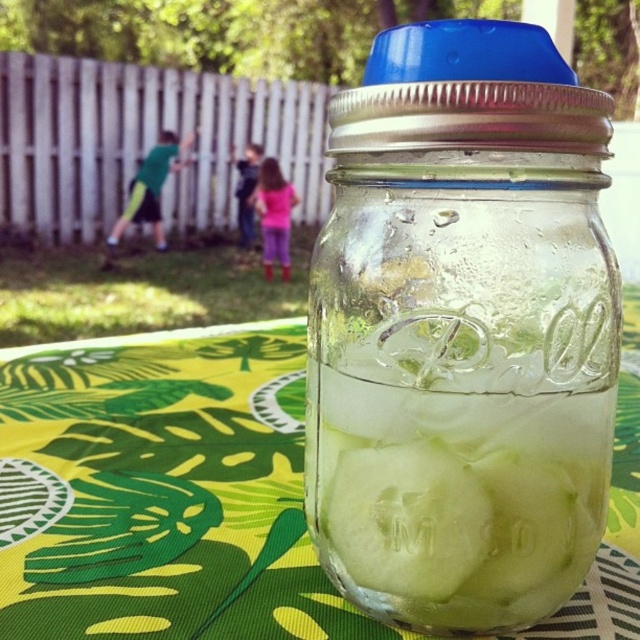
Question: Does clear glass jar at center have a greater width compared to pink fabric pants at center?

Choices:
 (A) no
 (B) yes

Answer: (B)

Question: Which object appears closest to the camera in this image?

Choices:
 (A) green fabric at center
 (B) green matte cucumber at center
 (C) clear glass ice at center

Answer: (C)

Question: Does clear glass jar at center have a smaller size compared to clear glass ice at center?

Choices:
 (A) no
 (B) yes

Answer: (A)

Question: Can you confirm if clear glass jar at center is thinner than pink fabric pants at center?

Choices:
 (A) no
 (B) yes

Answer: (A)

Question: Which of the following is the farthest from the observer?

Choices:
 (A) clear glass jar at center
 (B) clear glass ice at center

Answer: (B)

Question: Which of the following is the closest to the observer?

Choices:
 (A) (129, 205)
 (B) (467, 490)
 (C) (512, 378)

Answer: (C)